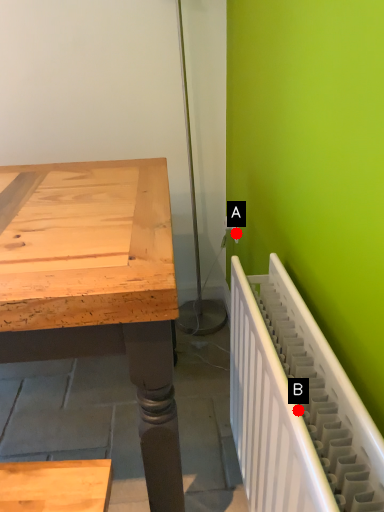
Question: Two points are circled on the image, labeled by A and B beside each circle. Which point is closer to the camera?

Choices:
 (A) A is closer
 (B) B is closer

Answer: (B)